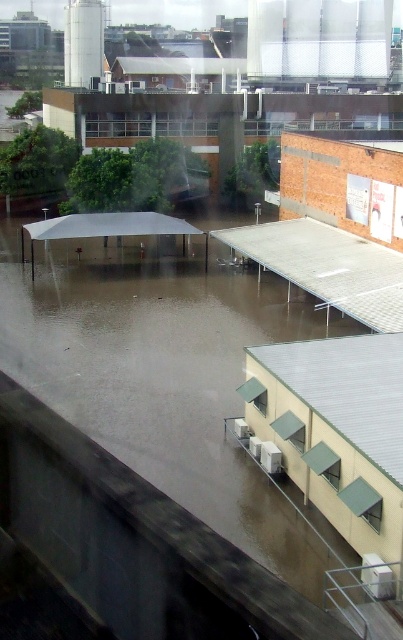
Can you confirm if brown/muddy water at center is positioned to the right of metallic silver awning at center?

Incorrect, brown/muddy water at center is not on the right side of metallic silver awning at center.

Is brown/muddy water at center further to the viewer compared to metallic silver awning at center?

No, it is not.

Which is in front, point (288, 483) or point (365, 250)?

Point (288, 483)

Where is `brown/muddy water at center`? The width and height of the screenshot is (403, 640). brown/muddy water at center is located at coordinates (166, 378).